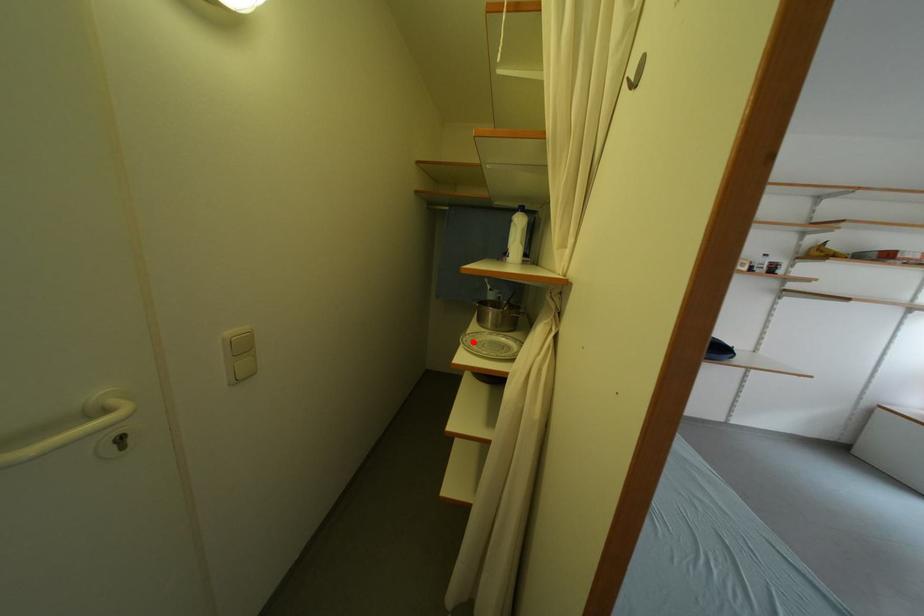
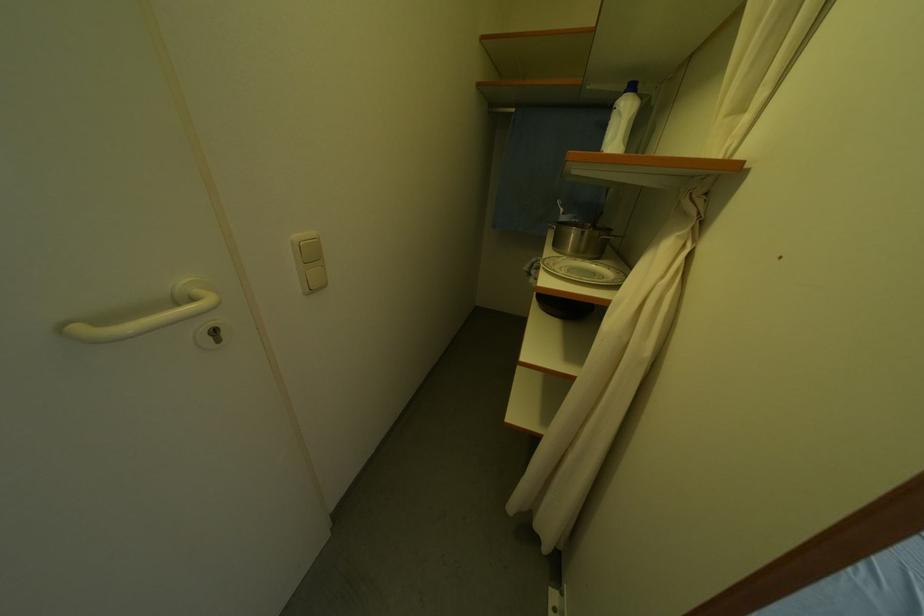
In the second image, find the point that corresponds to the highlighted location in the first image.

(554, 265)